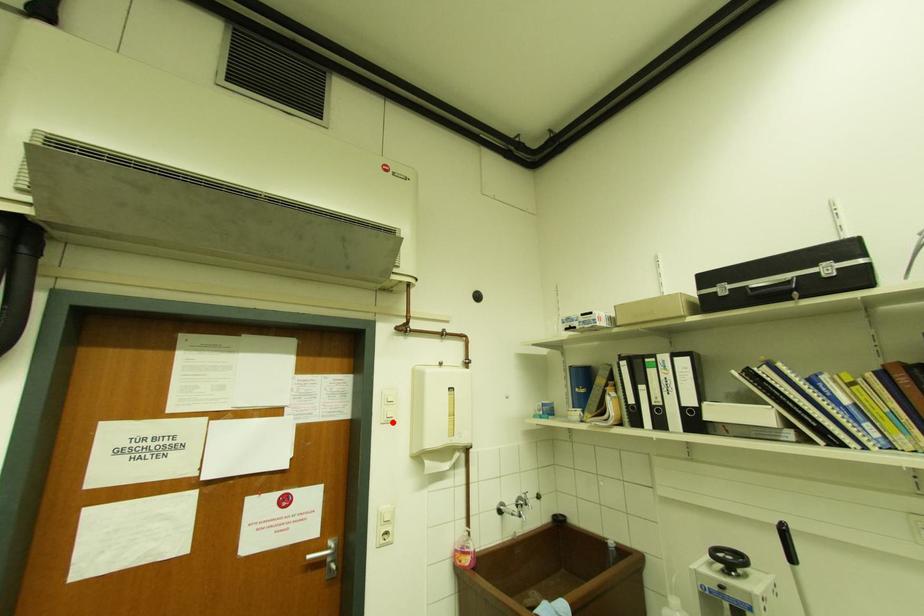
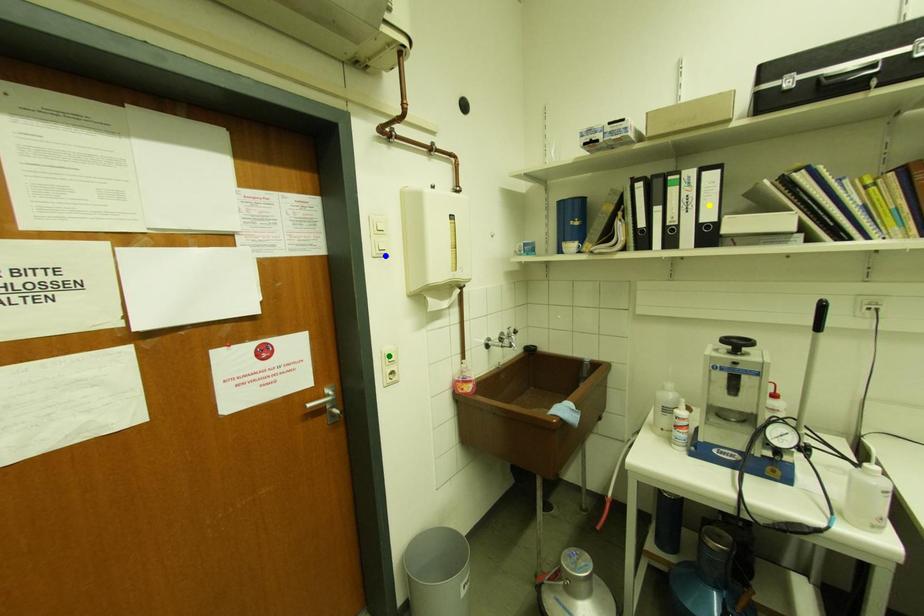
Question: I am providing you with two images of the same scene from different viewpoints. A red point is marked on the first image. You are given multiple points on the second image. In image 2, which mark is for the same physical point as the one in image 1?

Choices:
 (A) blue point
 (B) green point
 (C) yellow point

Answer: (A)